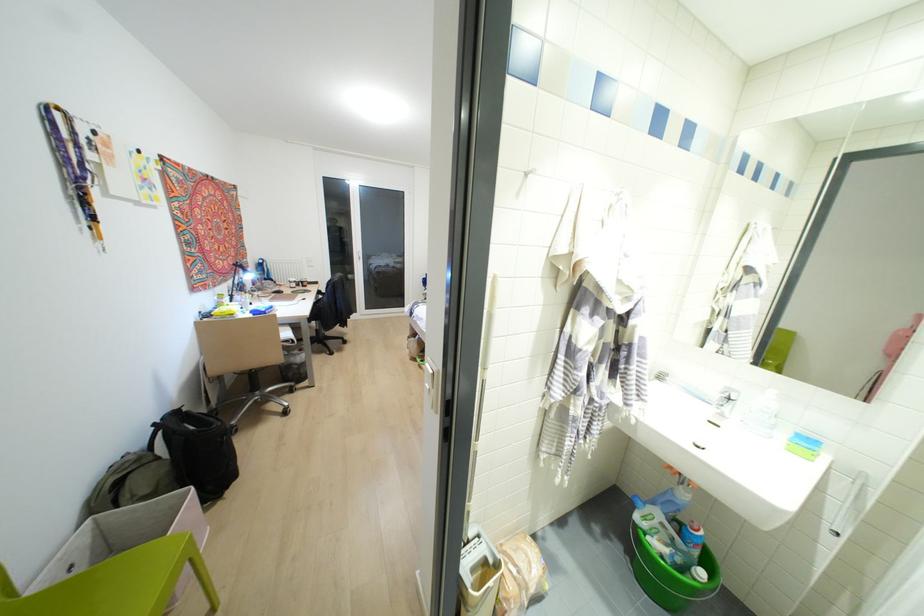
Image resolution: width=924 pixels, height=616 pixels. Describe the element at coordinates (116, 584) in the screenshot. I see `the green chair surface` at that location.